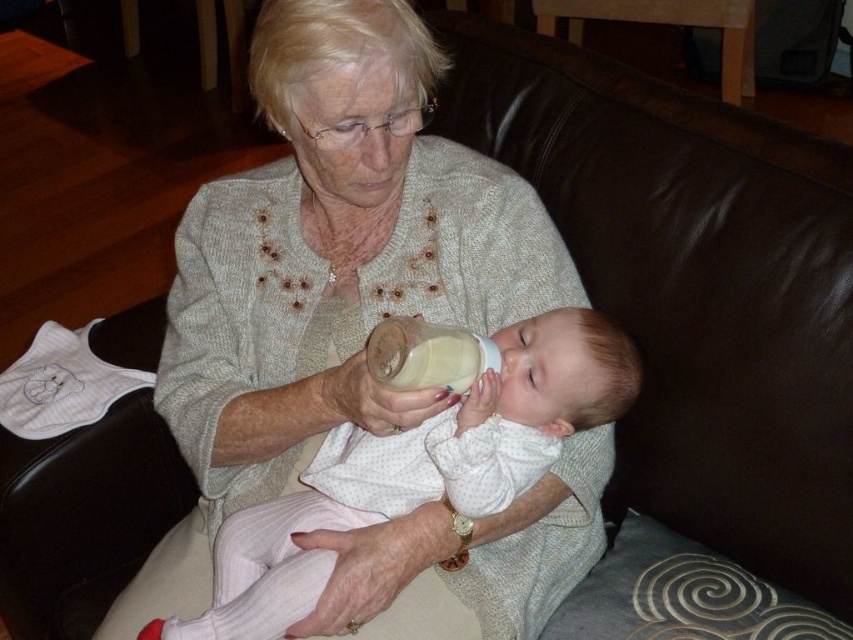
Question: Can you confirm if white cotton baby at center is wider than translucent plastic bottle at center?

Choices:
 (A) no
 (B) yes

Answer: (B)

Question: Which point is closer to the camera taking this photo?

Choices:
 (A) (469, 384)
 (B) (239, 596)

Answer: (A)

Question: Is white cotton baby at center above translucent plastic bottle at center?

Choices:
 (A) no
 (B) yes

Answer: (A)

Question: Is the position of white cotton baby at center less distant than that of translucent plastic bottle at center?

Choices:
 (A) yes
 (B) no

Answer: (B)

Question: Which point is farther to the camera?

Choices:
 (A) white cotton baby at center
 (B) translucent plastic bottle at center

Answer: (A)

Question: Which of the following is the closest to the observer?

Choices:
 (A) (463, 332)
 (B) (570, 330)

Answer: (A)